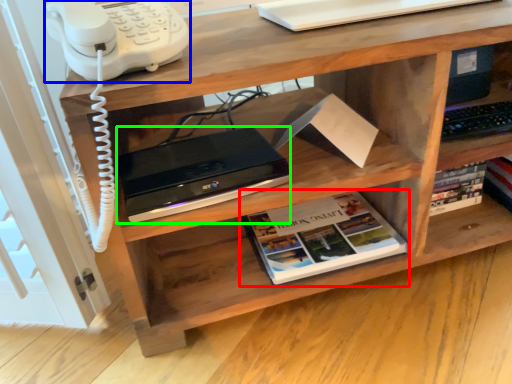
Question: Which object is positioned farthest from book (highlighted by a red box)? Select from corded phone (highlighted by a blue box) and computer (highlighted by a green box).

Choices:
 (A) corded phone
 (B) computer

Answer: (A)